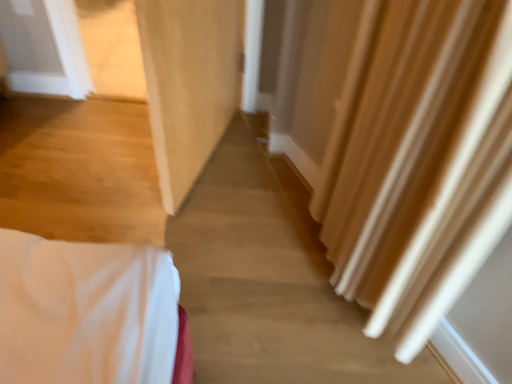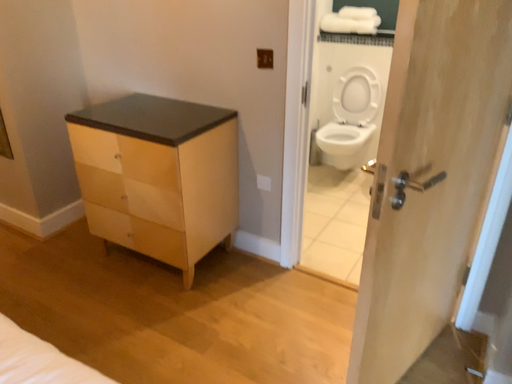
Question: Which way did the camera rotate in the video?

Choices:
 (A) rotated right
 (B) rotated left

Answer: (B)